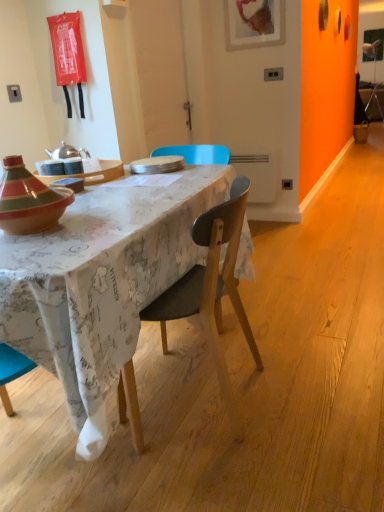
Question: From a real-world perspective, is wooden chair at center positioned over white matte plate at center based on gravity?

Choices:
 (A) no
 (B) yes

Answer: (A)

Question: Would you say wooden chair at center contains white matte plate at center?

Choices:
 (A) yes
 (B) no

Answer: (B)

Question: Is there a large distance between wooden chair at center and white matte plate at center?

Choices:
 (A) no
 (B) yes

Answer: (A)

Question: Is wooden chair at center directly adjacent to white matte plate at center?

Choices:
 (A) yes
 (B) no

Answer: (B)

Question: Is wooden chair at center facing towards white matte plate at center?

Choices:
 (A) no
 (B) yes

Answer: (A)

Question: Is wooden chair at center positioned behind white matte plate at center?

Choices:
 (A) yes
 (B) no

Answer: (B)

Question: Can you confirm if matte wooden tray at center is wider than white matte plate at center?

Choices:
 (A) yes
 (B) no

Answer: (A)

Question: Is matte wooden tray at center outside of white matte plate at center?

Choices:
 (A) yes
 (B) no

Answer: (A)

Question: Is matte wooden tray at center at the left side of white matte plate at center?

Choices:
 (A) no
 (B) yes

Answer: (B)

Question: From a real-world perspective, does matte wooden tray at center sit lower than white matte plate at center?

Choices:
 (A) yes
 (B) no

Answer: (B)

Question: Considering the relative sizes of matte wooden tray at center and white matte plate at center in the image provided, is matte wooden tray at center taller than white matte plate at center?

Choices:
 (A) no
 (B) yes

Answer: (B)

Question: Does matte wooden tray at center lie in front of white matte plate at center?

Choices:
 (A) yes
 (B) no

Answer: (A)

Question: From a real-world perspective, is white matte plate at center below wooden chair at center?

Choices:
 (A) yes
 (B) no

Answer: (B)